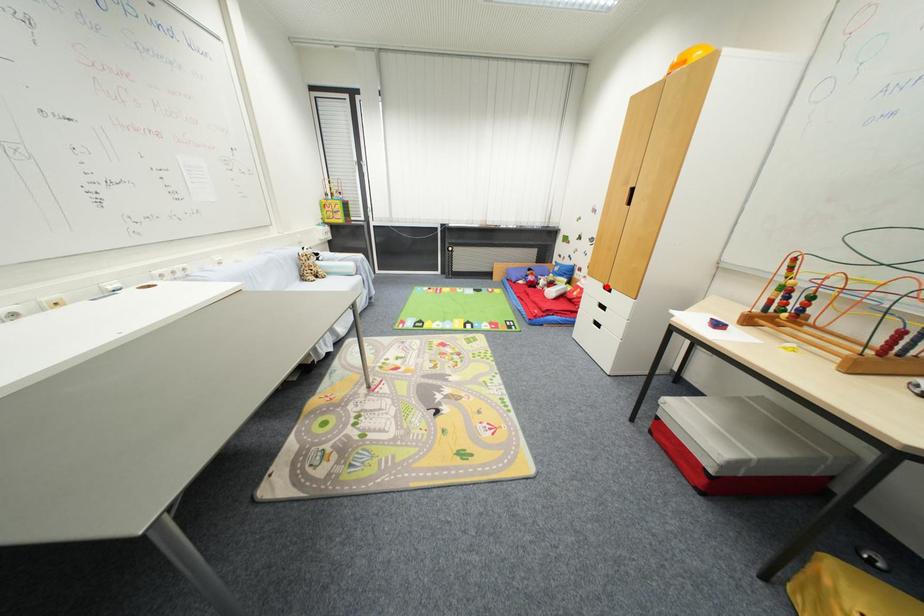
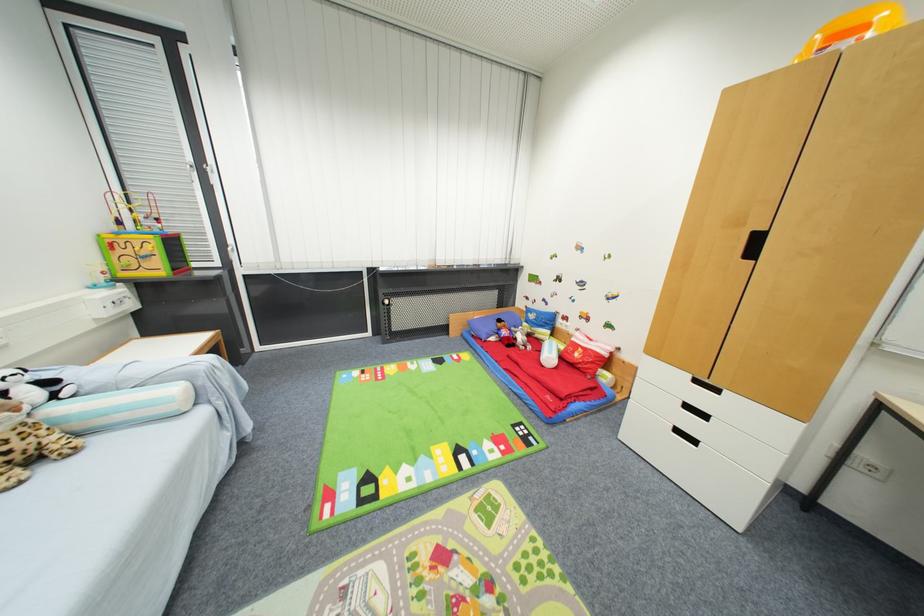
The point at the highlighted location is marked in the first image. Where is the corresponding point in the second image?

(695, 378)